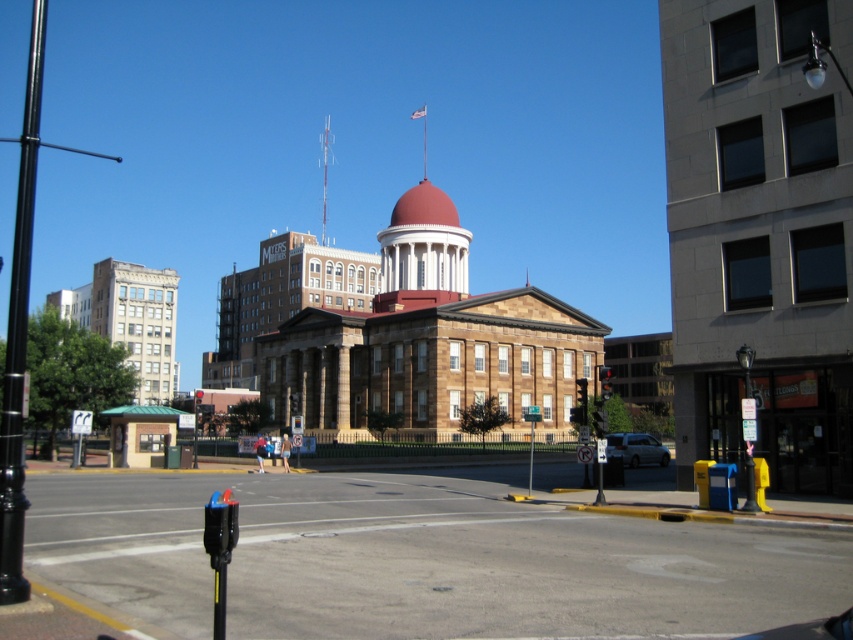
You are a city planner assessing the street layout. Given the presence of the metallic parking meter at lower left and the silver metallic van at lower right, which object would block a pedestrian crossing more significantly if placed in the middle of the road?

The metallic parking meter at lower left would block the pedestrian crossing more significantly because it is bigger than the silver metallic van at lower right.

You are a pedestrian standing at the street intersection and want to find the closest object to you between the metallic parking meter at lower left and the black metal pole at left. Which one is closer to you?

The metallic parking meter at lower left is closer to you because it is positioned below the black metal pole at left, indicating it is nearer in the scene.

You are standing at the intersection in front of the Illinois State Capitol and want to walk to a point that is closer to the camera. Which of the two points, point (x=395, y=570) or point (x=611, y=444), should you head towards?

You should head towards point (x=395, y=570) because it is closer to the camera than point (x=611, y=444).